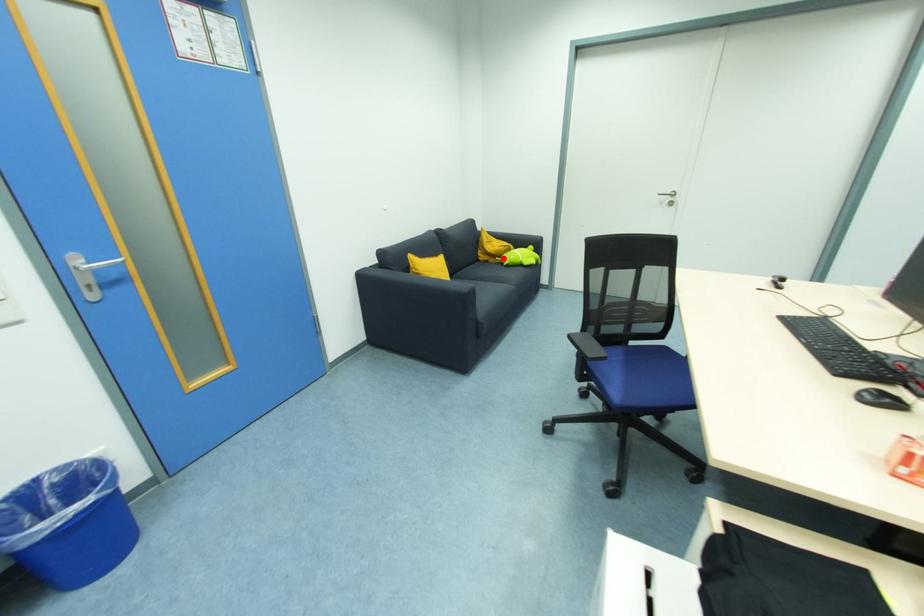
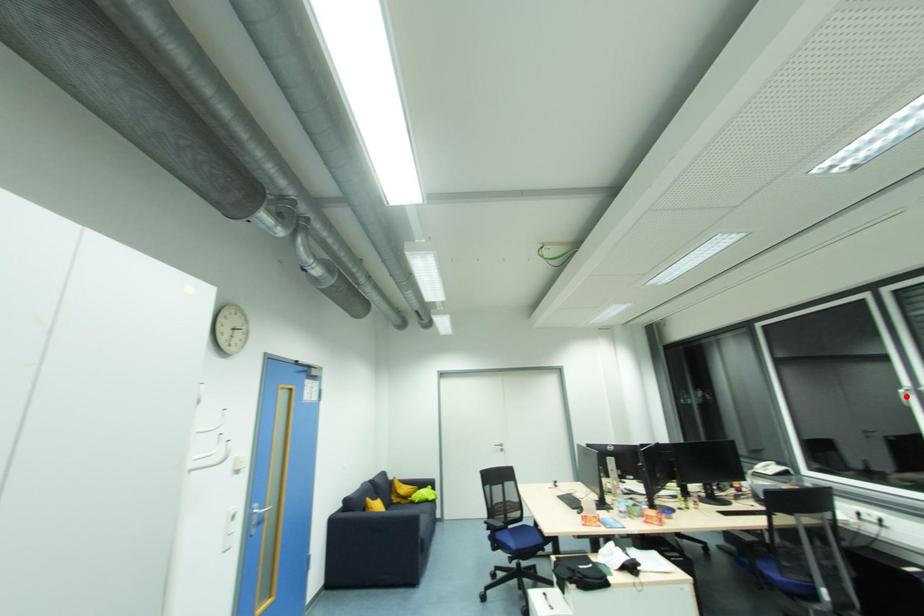
I am providing you with two images of the same scene from different viewpoints. A red point is marked on the first image and another point is marked on the second image. Does the point marked in image1 correspond to the same location as the one in image2?

No